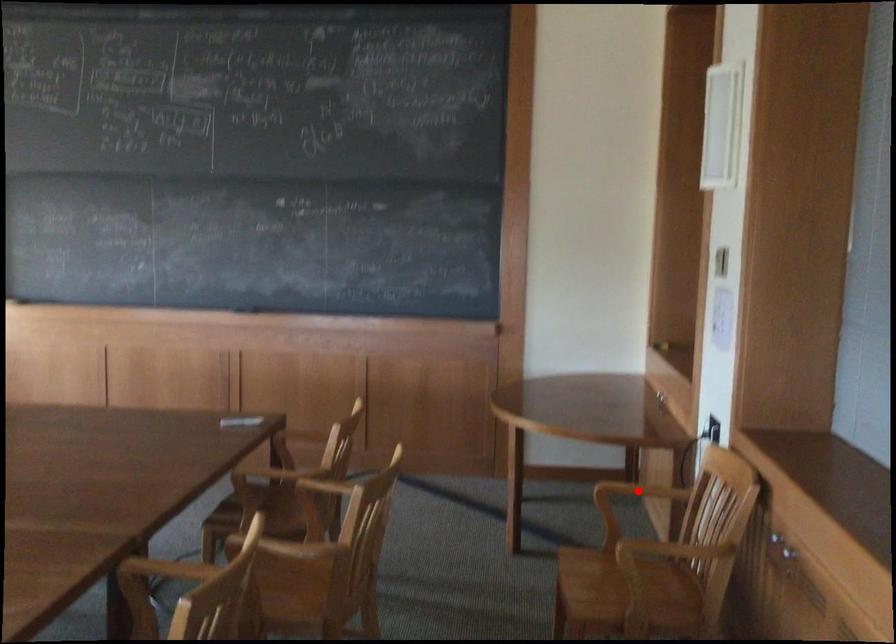
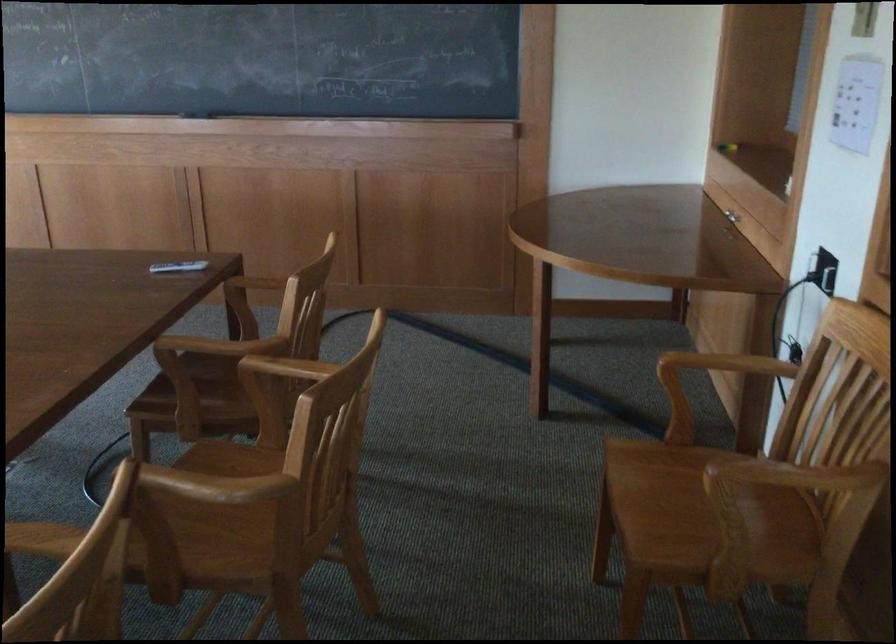
Question: I am providing you with two images of the same scene from different viewpoints. A red point is marked on the first image. Is the red point's position out of view in image 2?

Choices:
 (A) Yes
 (B) No

Answer: (A)